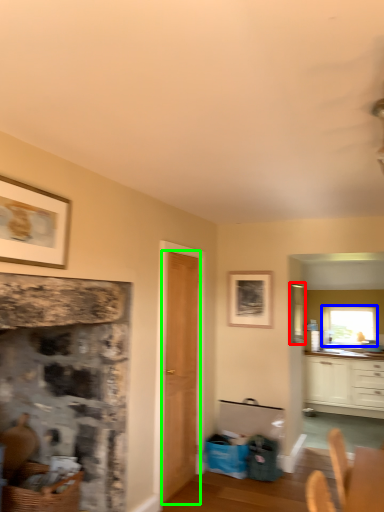
Question: Based on their relative distances, which object is farther from window screen (highlighted by a red box)? Choose from window (highlighted by a blue box) and door (highlighted by a green box).

Choices:
 (A) window
 (B) door

Answer: (B)